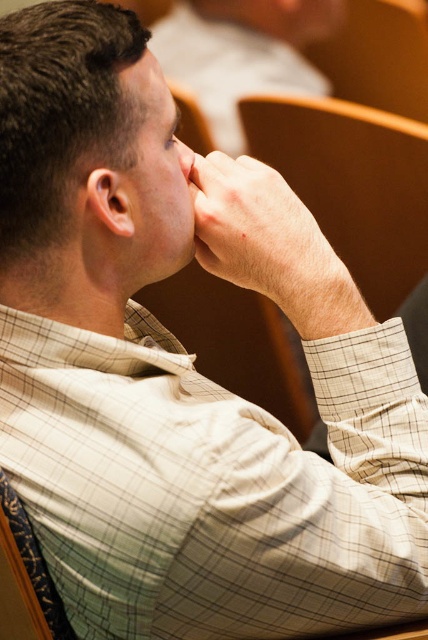
Question: Is brown wood chair at center below smooth skin hand at center?

Choices:
 (A) no
 (B) yes

Answer: (A)

Question: Among these points, which one is farthest from the camera?

Choices:
 (A) (282, 141)
 (B) (276, 172)

Answer: (A)

Question: Which point appears closest to the camera in this image?

Choices:
 (A) (178, 138)
 (B) (205, 164)
 (C) (320, 205)

Answer: (B)

Question: Does brown wood chair at center have a larger size compared to smooth skin nose at center?

Choices:
 (A) no
 (B) yes

Answer: (B)

Question: Considering the relative positions of brown wood chair at center and smooth skin hand at center in the image provided, where is brown wood chair at center located with respect to smooth skin hand at center?

Choices:
 (A) left
 (B) right

Answer: (B)

Question: Which of these objects is positioned closest to the brown wood chair at center?

Choices:
 (A) smooth skin nose at center
 (B) smooth skin hand at center

Answer: (A)